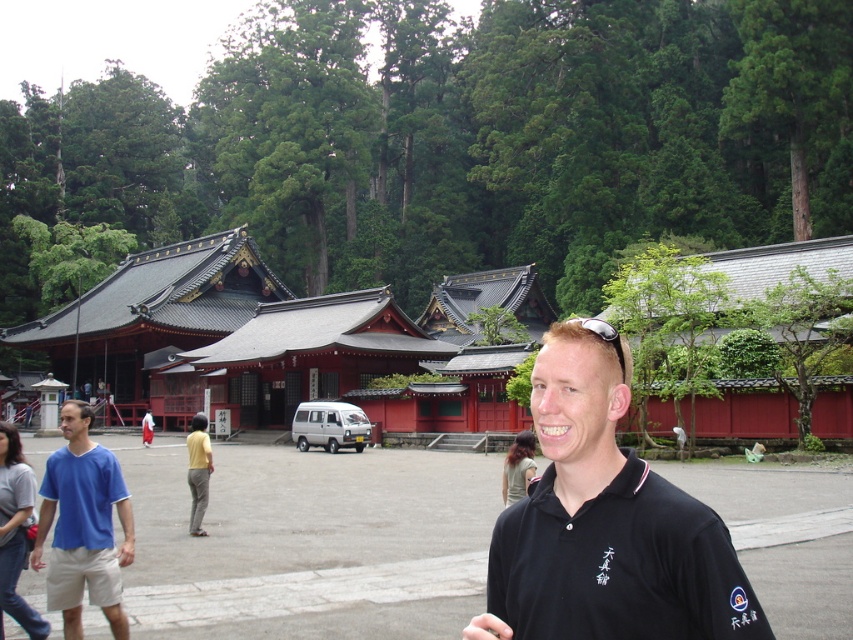
You are a photographer at the shrine and need to capture both the blue cotton shirt at left and the matte blue polo shirt at left in a single frame. Which shirt should you focus on first to ensure both are in the frame?

The blue cotton shirt at left is taller than the matte blue polo shirt at left, so focusing on the taller one first will help ensure both are captured in the frame.

You are standing at the point labeled point [96,548] and want to take a photo of the shrine. There is a man blocking your view at point [599,456]. Since the man is between you and the shrine, can you move behind him to get a clearer shot?

The point labeled point [599,456] is in front of point [96,548], so the man at point [599,456] is closer to the shrine than you are. To get a clearer shot without obstruction, you should move forward past the man to a position closer to the shrine than he is.

Looking at this image, you are a photographer at the temple complex and want to take a photo of the shrine buildings. There are two people in blue shirts at the left side of your viewfinder. The blue cotton shirt at left and the matte blue polo shirt at left are blocking your shot. Which one do you need to ask to move first to get an unobstructed view?

You should ask the blue cotton shirt at left to move first because it is in front of the matte blue polo shirt at left, so moving it first will allow you to see the shrine buildings without obstruction.